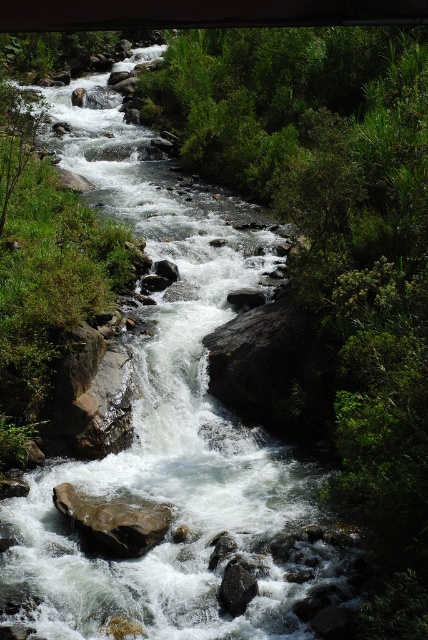
You are standing at the edge of the river and see both the brown rough rock at center and the black smooth rock at center. Which rock is positioned more to the left side of the river?

The brown rough rock at center is positioned more to the left side of the river compared to the black smooth rock at center.

You are standing at the edge of the river and see the brown rough rock at center and the black smooth rock at center. Which rock is closer to you?

The brown rough rock at center is closer to you than the black smooth rock at center.

You are a hiker who wants to cross the river using the rocks. You need to step on the brown rough rock at center and the black smooth rock at center. Which rock should you step on first to reach the other side safely?

You should step on the brown rough rock at center first because it is much taller than the black smooth rock at center, providing a more stable and elevated position for crossing.